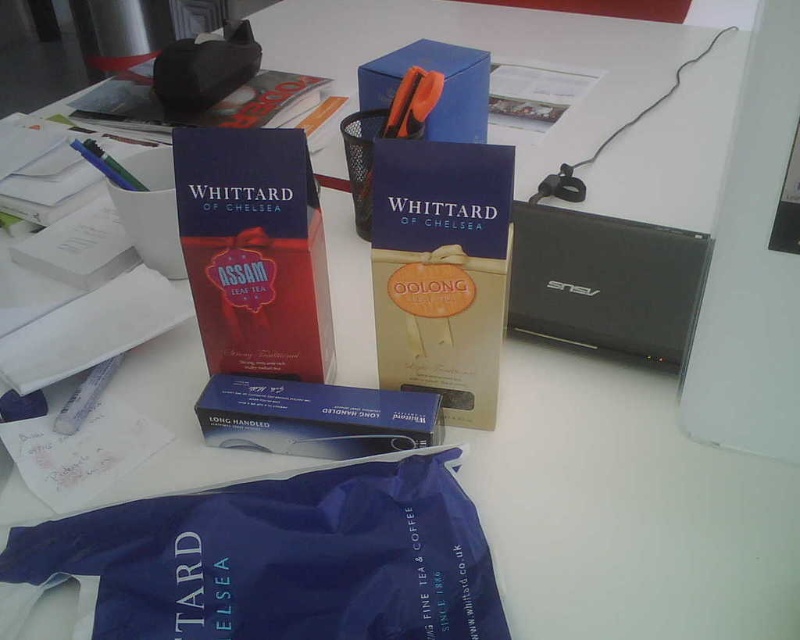
You need to pack the white paper at lower left into a container. Can the blue cardboard box at upper center accommodate it based on their sizes?

The blue cardboard box at upper center is larger in size than the white paper at lower left, so it can accommodate the white paper at lower left.

Based on the photo, you are organizing items on a desk and need to place the blue fabric bag at lower center and the blue cardboard box at upper center into a drawer. The drawer has a height limit of 10 cm. Which item is more likely to fit inside the drawer based on their heights?

The blue fabric bag at lower center is shorter than the blue cardboard box at upper center. Since the drawer has a height limit of 10 cm, the blue fabric bag at lower center is more likely to fit inside the drawer.